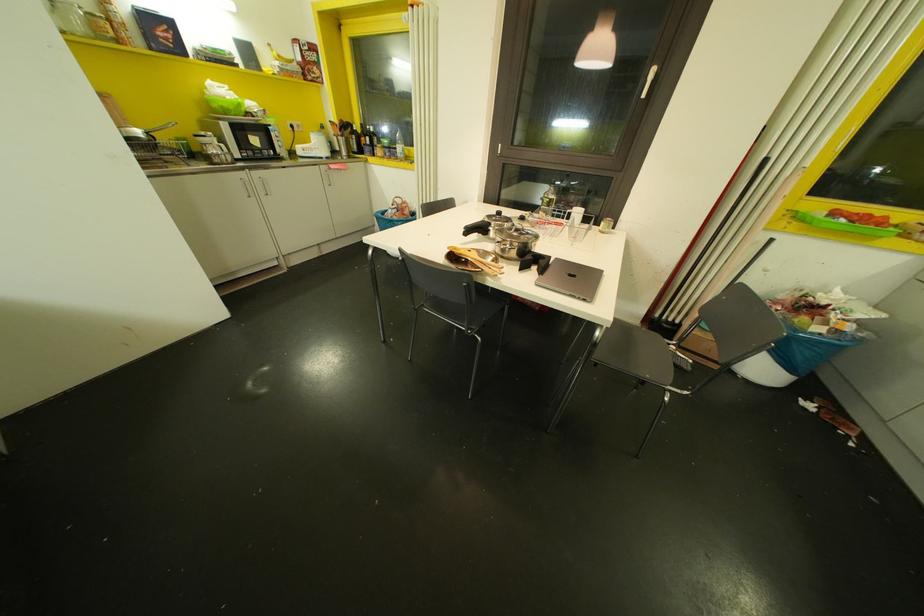
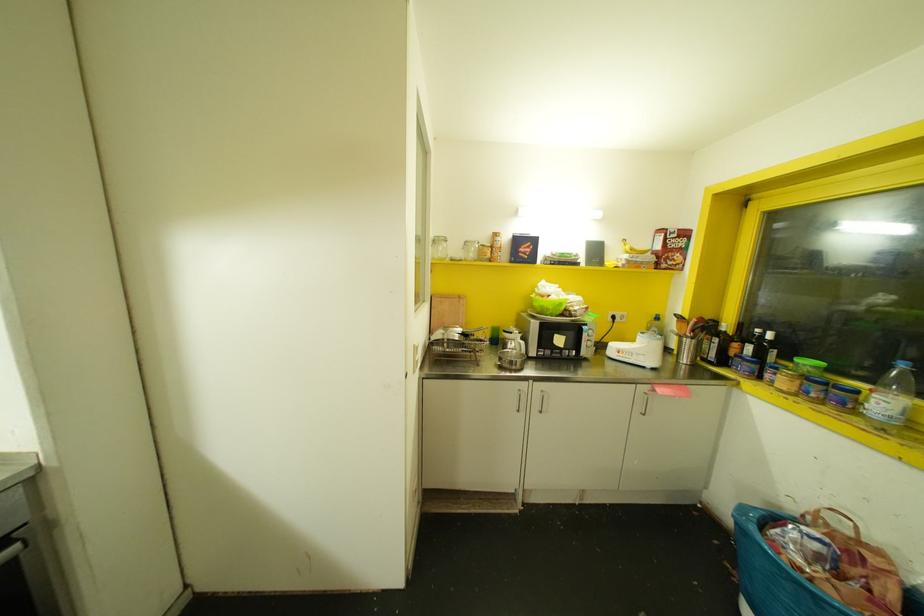
In the second image, find the point that corresponds to (x=359, y=150) in the first image.

(723, 361)